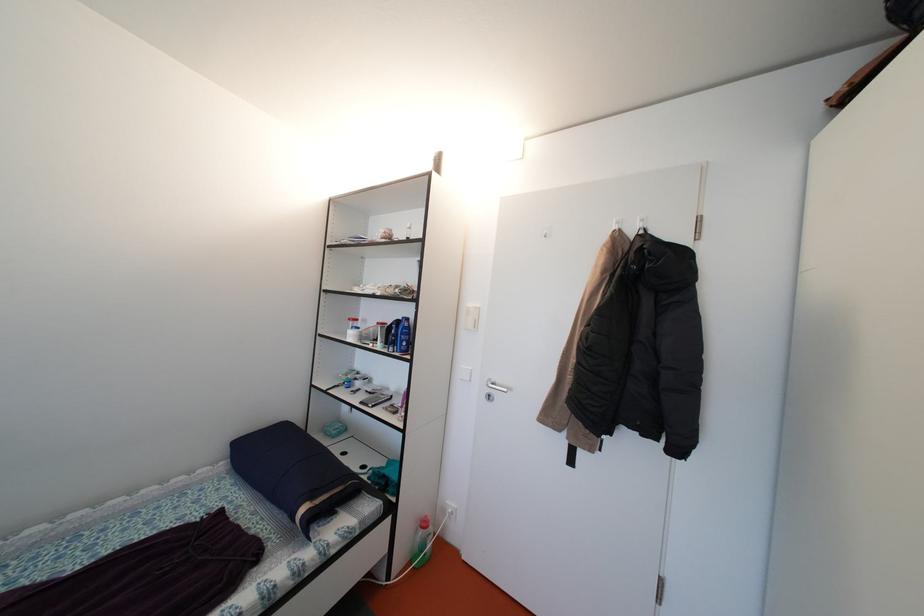
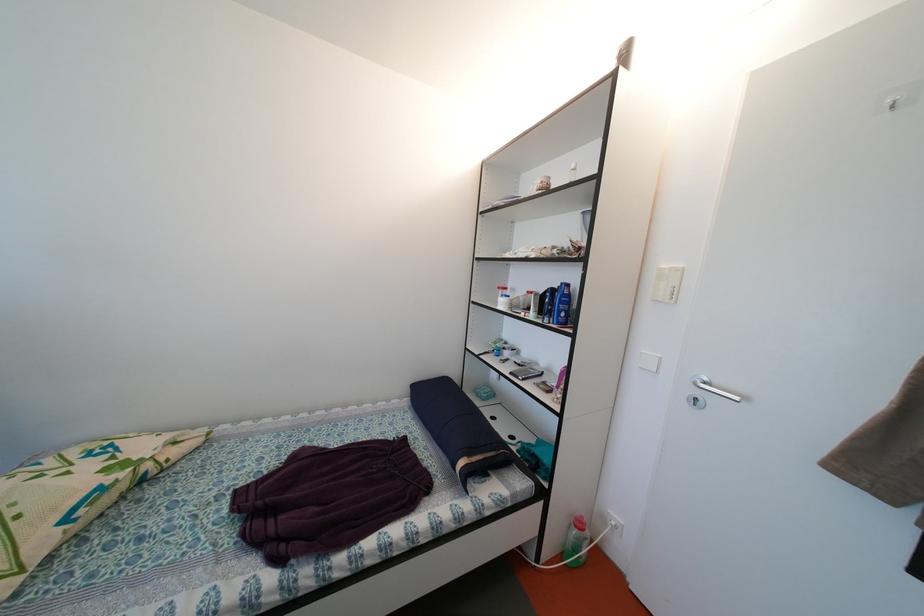
Where in the second image is the point corresponding to point 432,529 from the first image?

(587, 530)